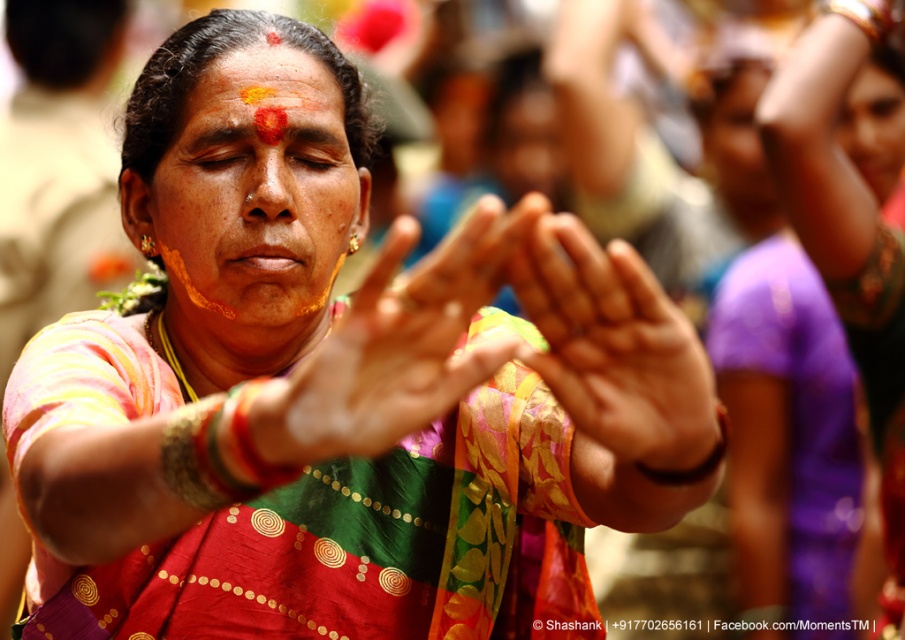
Between point (408, 236) and point (549, 234), which one is positioned in front?

Positioned in front is point (408, 236).

Does matte gold hands at center have a greater width compared to matte fabric hands at center?

Yes, matte gold hands at center is wider than matte fabric hands at center.

Measure the distance between point (x=408, y=372) and camera.

Point (x=408, y=372) and camera are 91.79 centimeters apart from each other.

Find the location of a particular element. matte gold hands at center is located at coordinates (393, 349).

Is matte yellow face at center thinner than matte fabric hands at center?

No, matte yellow face at center is not thinner than matte fabric hands at center.

Can you confirm if matte yellow face at center is smaller than matte fabric hands at center?

No.

Measure the distance between matte yellow face at center and camera.

matte yellow face at center is 4.98 feet from camera.

Image resolution: width=905 pixels, height=640 pixels. In order to click on matte yellow face at center in this screenshot , I will do `click(253, 195)`.

In the scene shown: Does matte fabric hands at center have a lesser width compared to matte orange paste at center?

Yes.

Which is behind, point (568, 346) or point (256, 120)?

Positioned behind is point (256, 120).

This screenshot has height=640, width=905. Describe the element at coordinates (614, 348) in the screenshot. I see `matte fabric hands at center` at that location.

Where is `matte fabric hands at center`? matte fabric hands at center is located at coordinates (614, 348).